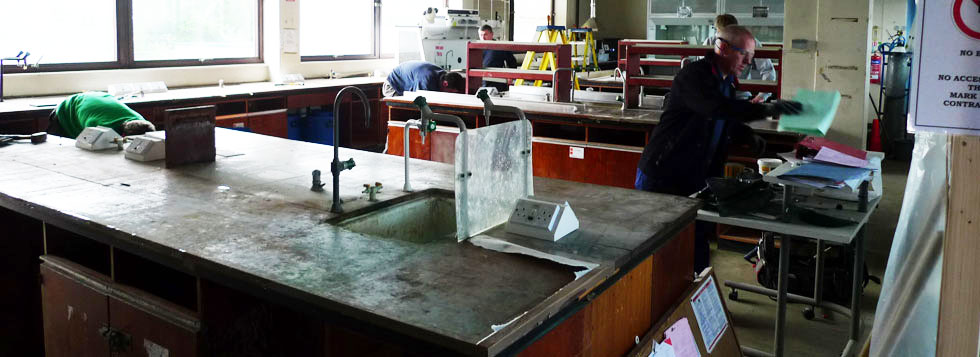
What are the coordinates of `windows` in the screenshot? It's located at (26, 28), (204, 38), (331, 27), (398, 39), (540, 15), (560, 15).